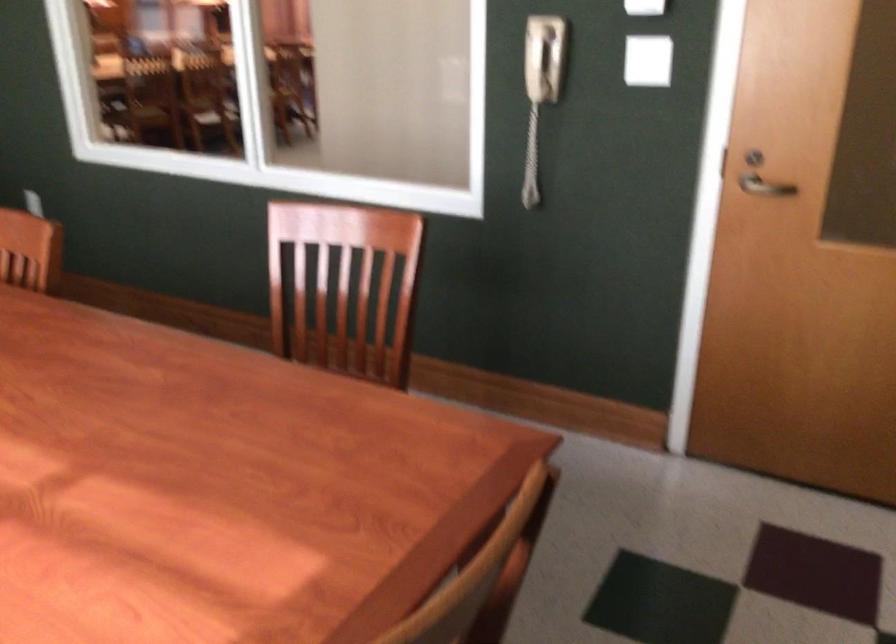
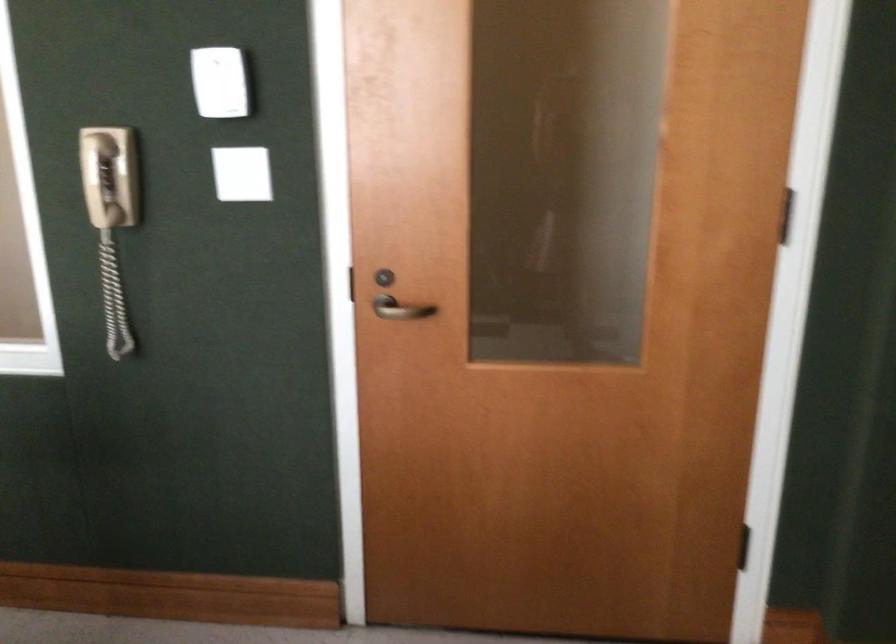
Where in the second image is the point corresponding to (x=767, y=184) from the first image?

(401, 308)